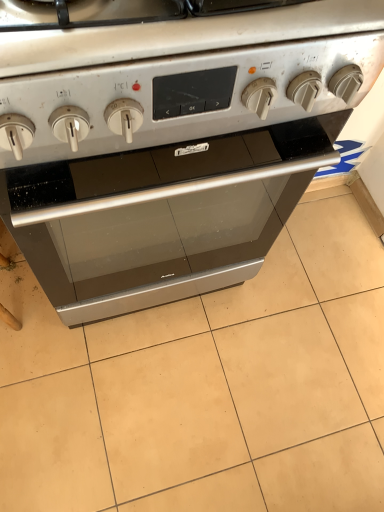
Question: Is matte silver oven at center behind satin silver oven at center?

Choices:
 (A) yes
 (B) no

Answer: (A)

Question: Considering the relative positions of matte silver oven at center and satin silver oven at center in the image provided, is matte silver oven at center in front of satin silver oven at center?

Choices:
 (A) yes
 (B) no

Answer: (B)

Question: From a real-world perspective, is matte silver oven at center on top of satin silver oven at center?

Choices:
 (A) no
 (B) yes

Answer: (A)

Question: From the image's perspective, is matte silver oven at center below satin silver oven at center?

Choices:
 (A) no
 (B) yes

Answer: (B)

Question: Does matte silver oven at center appear on the left side of satin silver oven at center?

Choices:
 (A) no
 (B) yes

Answer: (A)

Question: Is matte silver oven at center facing towards satin silver oven at center?

Choices:
 (A) yes
 (B) no

Answer: (B)

Question: Is satin silver oven at center further to camera compared to matte silver oven at center?

Choices:
 (A) no
 (B) yes

Answer: (A)

Question: Is satin silver oven at center bigger than matte silver oven at center?

Choices:
 (A) no
 (B) yes

Answer: (B)

Question: Does satin silver oven at center have a greater width compared to matte silver oven at center?

Choices:
 (A) no
 (B) yes

Answer: (A)

Question: Is satin silver oven at center taller than matte silver oven at center?

Choices:
 (A) yes
 (B) no

Answer: (A)

Question: Could you tell me if satin silver oven at center is turned towards matte silver oven at center?

Choices:
 (A) no
 (B) yes

Answer: (B)

Question: Is satin silver oven at center at the right side of matte silver oven at center?

Choices:
 (A) yes
 (B) no

Answer: (B)

Question: Considering the relative positions of matte silver oven at center and satin silver oven at center in the image provided, is matte silver oven at center to the left or to the right of satin silver oven at center?

Choices:
 (A) right
 (B) left

Answer: (A)